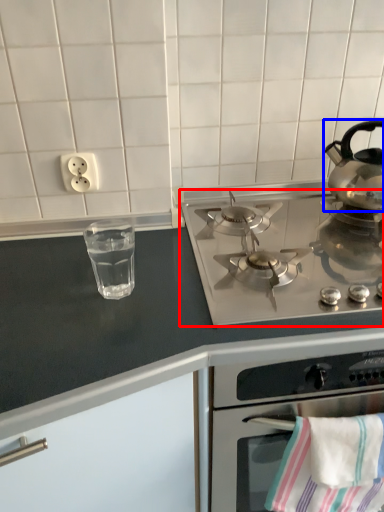
Question: Which object is further to the camera taking this photo, gas stove (highlighted by a red box) or kettle (highlighted by a blue box)?

Choices:
 (A) gas stove
 (B) kettle

Answer: (B)